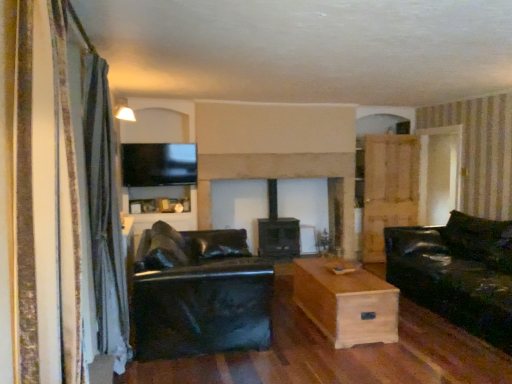
The width and height of the screenshot is (512, 384). What are the coordinates of `free space in front of light brown wood coffee table at center` in the screenshot? It's located at (359, 363).